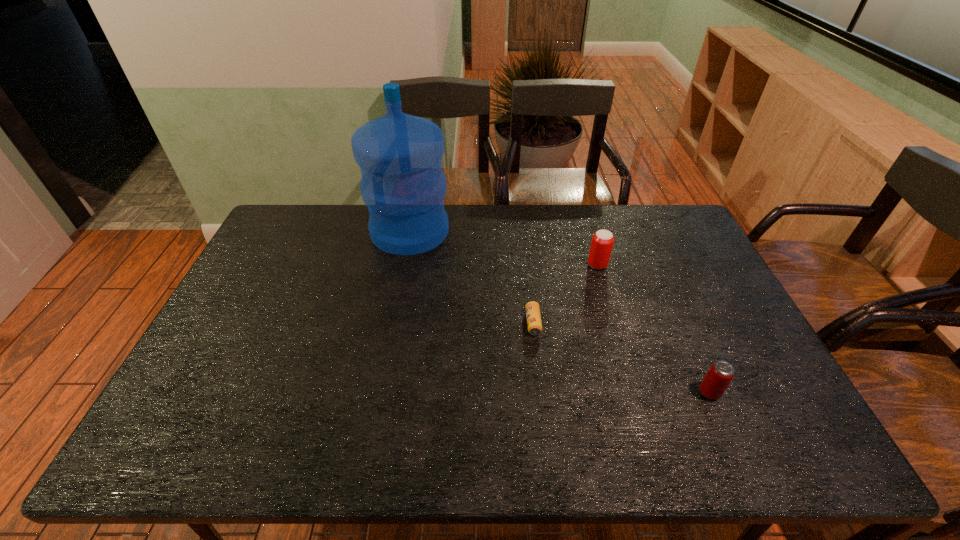
Identify the location of vacant region between the farthest beer can and the nearest beer can. (654, 329).

What are the coordinates of `vacant area between the second nearest object and the second beer can from right to left` in the screenshot? It's located at (565, 294).

Find the location of a particular element. The width and height of the screenshot is (960, 540). empty location between the nearest beer can and the second object from right to left is located at coordinates (654, 329).

Where is `vacant point located between the second nearest object and the third nearest object`? The image size is (960, 540). vacant point located between the second nearest object and the third nearest object is located at coordinates (565, 294).

This screenshot has width=960, height=540. I want to click on vacant area that lies between the shortest object and the rightmost beer can, so (621, 357).

You are a GUI agent. You are given a task and a screenshot of the screen. Output one action in this format:
    pyautogui.click(x=<x>, y=<y>)
    Task: Click on the unoccupied area between the rightmost beer can and the second beer can from right to left
    The height and width of the screenshot is (540, 960).
    Given the screenshot: What is the action you would take?
    pyautogui.click(x=654, y=329)

Find the location of a particular element. The image size is (960, 540). vacant area that lies between the water jug and the shortest beer can is located at coordinates (471, 277).

You are a GUI agent. You are given a task and a screenshot of the screen. Output one action in this format:
    pyautogui.click(x=<x>, y=<y>)
    Task: Click on the free space that is in between the water jug and the rightmost beer can
    This screenshot has width=960, height=540.
    Given the screenshot: What is the action you would take?
    pyautogui.click(x=560, y=312)

What are the coordinates of `vacant space in between the leftmost object and the third tallest object` in the screenshot? It's located at (560, 312).

Image resolution: width=960 pixels, height=540 pixels. What are the coordinates of `object that is the second nearest to the second tallest object` in the screenshot? It's located at (720, 374).